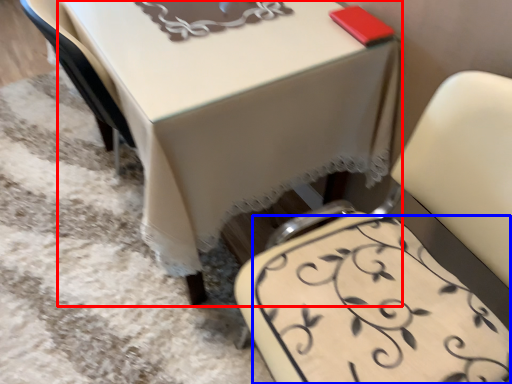
Question: Among these objects, which one is nearest to the camera, table (highlighted by a red box) or design (highlighted by a blue box)?

Choices:
 (A) table
 (B) design

Answer: (B)